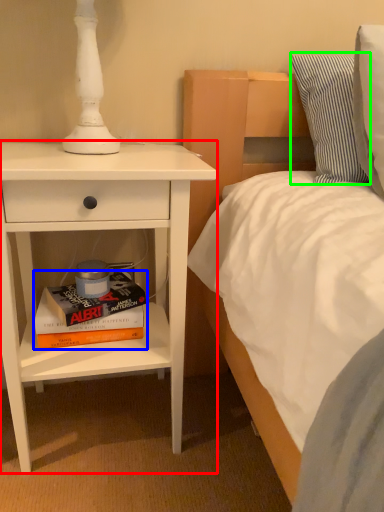
Question: Based on their relative distances, which object is nearer to nightstand (highlighted by a red box)? Choose from book (highlighted by a blue box) and pillow (highlighted by a green box).

Choices:
 (A) book
 (B) pillow

Answer: (A)